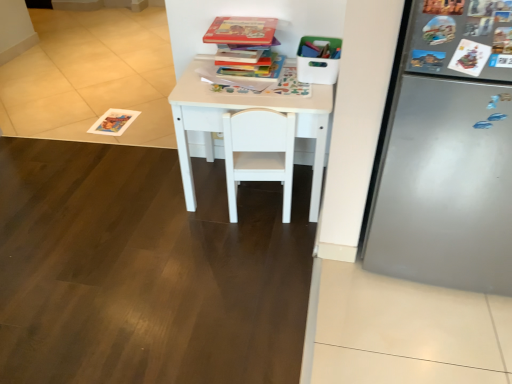
Find the location of `free region on the left part of white matte table at center`. free region on the left part of white matte table at center is located at coordinates (145, 201).